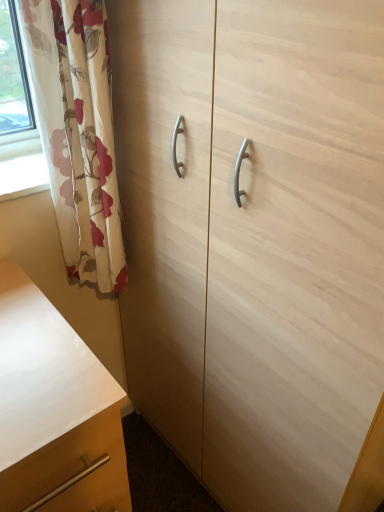
Find the location of a particular element. vacant space situated above matte wood chest of drawers at lower left (from a real-world perspective) is located at coordinates (28, 346).